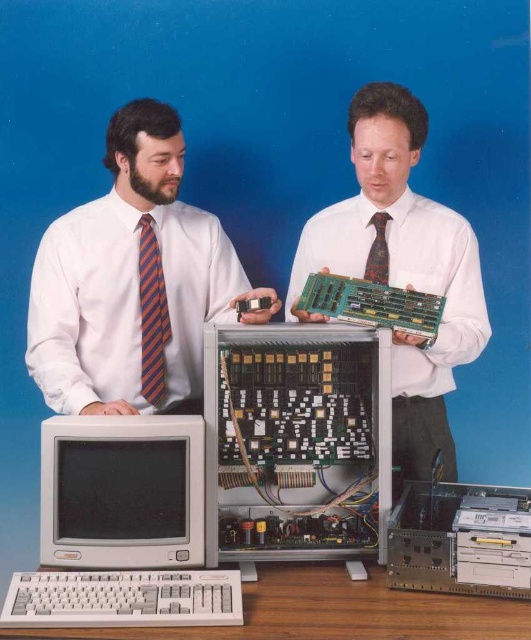
Is point (426, 474) farther from viewer compared to point (152, 221)?

Yes, point (426, 474) is farther from viewer.

Can you confirm if matte green circuit board at center is thinner than striped fabric tie at left?

No.

Between point (397, 100) and point (151, 364), which one is positioned behind?

Point (151, 364)

This screenshot has width=531, height=640. I want to click on matte green circuit board at center, so (x=402, y=269).

Does white shirt at left have a lesser width compared to silver metallic computer at center?

Incorrect, white shirt at left's width is not less than silver metallic computer at center's.

Does white shirt at left appear over silver metallic computer at center?

Indeed, white shirt at left is positioned over silver metallic computer at center.

Who is more forward, (264, 320) or (301, 449)?

Positioned in front is point (264, 320).

Locate an element on the screen. This screenshot has width=531, height=640. white shirt at left is located at coordinates (132, 280).

Can you confirm if white shirt at left is positioned to the left of striped fabric tie at left?

In fact, white shirt at left is to the right of striped fabric tie at left.

Which is more to the left, white shirt at left or striped fabric tie at left?

striped fabric tie at left

This screenshot has height=640, width=531. Describe the element at coordinates (132, 280) in the screenshot. I see `white shirt at left` at that location.

Locate an element on the screen. white shirt at left is located at coordinates (132, 280).